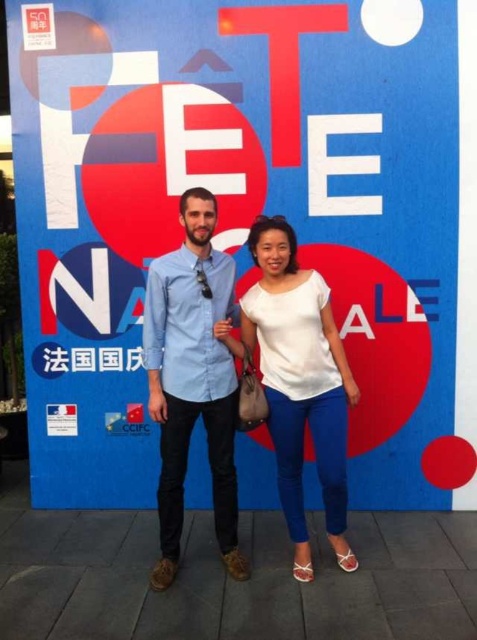
Is blue denim shirt at center smaller than white matte blouse at center?

Actually, blue denim shirt at center might be larger than white matte blouse at center.

Based on the photo, between blue denim shirt at center and white matte blouse at center, which one appears on the right side from the viewer's perspective?

white matte blouse at center is more to the right.

Does point (174, 480) come behind point (302, 301)?

Yes, it is.

This screenshot has height=640, width=477. In order to click on blue denim shirt at center in this screenshot , I will do `click(193, 378)`.